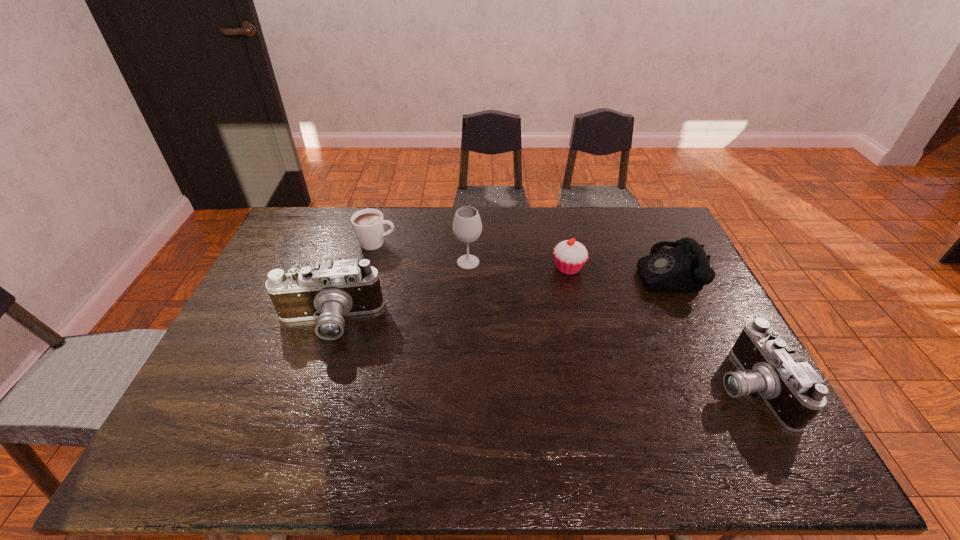
Where is `the second tallest object`? The image size is (960, 540). the second tallest object is located at coordinates (328, 291).

Find the location of a particular element. This screenshot has width=960, height=540. the taller camera is located at coordinates pos(328,291).

Image resolution: width=960 pixels, height=540 pixels. I want to click on the right camera, so click(794, 392).

I want to click on telephone, so click(685, 268).

I want to click on the third object from right to left, so pos(569,255).

You are a GUI agent. You are given a task and a screenshot of the screen. Output one action in this format:
    pyautogui.click(x=<x>, y=<y>)
    Task: Click on the cappuccino
    
    Given the screenshot: What is the action you would take?
    pyautogui.click(x=368, y=224)

Image resolution: width=960 pixels, height=540 pixels. I want to click on the tallest object, so click(x=467, y=226).

The height and width of the screenshot is (540, 960). Identify the location of wineglass. (467, 226).

Find the location of a particular element. This screenshot has height=540, width=960. free space located at the lens of the left camera is located at coordinates (312, 370).

The width and height of the screenshot is (960, 540). I want to click on free location located 0.320m at the lens of the shorter camera, so click(588, 386).